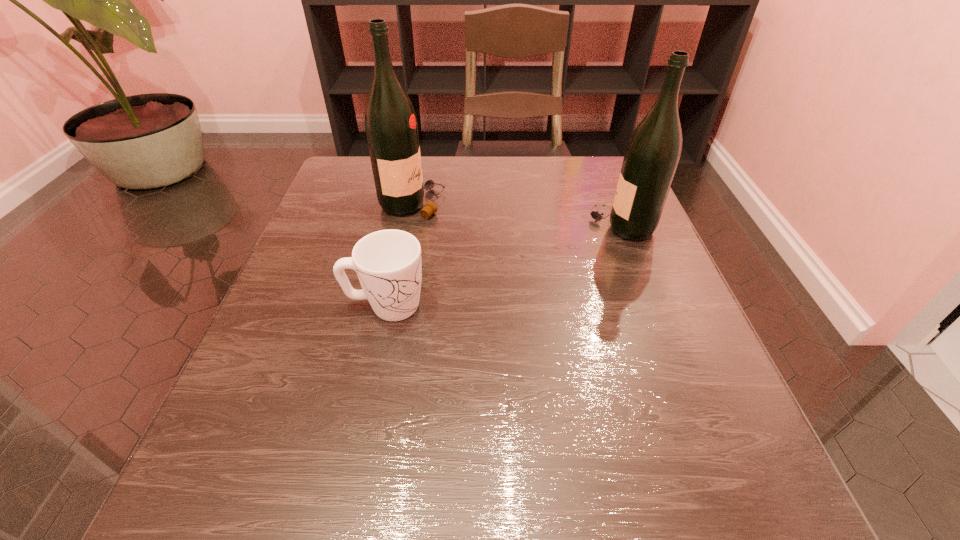
This screenshot has width=960, height=540. In order to click on the left wine bottle in this screenshot , I will do `click(391, 127)`.

Find the location of a particular element. This screenshot has width=960, height=540. the rightmost object is located at coordinates (653, 152).

Find the location of a particular element. This screenshot has width=960, height=540. mug is located at coordinates (388, 263).

Find the location of `the nearest object`. the nearest object is located at coordinates (388, 263).

This screenshot has height=540, width=960. Find the location of `vacant space situated on the surface of the left wine bottle`. vacant space situated on the surface of the left wine bottle is located at coordinates (471, 204).

You are a GUI agent. You are given a task and a screenshot of the screen. Output one action in this format:
    pyautogui.click(x=<x>, y=<y>)
    Task: Click on the vacant space located 0.050m on the left of the right wine bottle
    The width and height of the screenshot is (960, 540).
    Given the screenshot: What is the action you would take?
    pyautogui.click(x=567, y=226)

The height and width of the screenshot is (540, 960). Identify the location of vacant space situated on the side of the shortest object with the handle. (555, 306).

Find the location of a particular element. wine bottle located at the left edge is located at coordinates (391, 127).

The width and height of the screenshot is (960, 540). Identify the location of mug that is at the left edge. (388, 263).

At what (x,y) coordinates should I click in order to perform the action: click on object located at the right edge. Please return your answer as a coordinate pair (x, y). The height and width of the screenshot is (540, 960). Looking at the image, I should click on (653, 152).